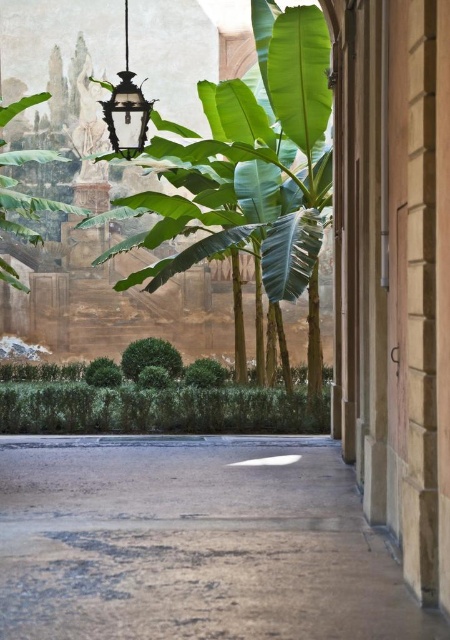
Between concrete sidewalk at center and green leafy shrubs at center, which one is positioned higher?

green leafy shrubs at center is higher up.

Is concrete sidewalk at center wider than green leafy shrubs at center?

In fact, concrete sidewalk at center might be narrower than green leafy shrubs at center.

At what (x,y) coordinates should I click in order to perform the action: click on concrete sidewalk at center. Please return your answer as a coordinate pair (x, y). The height and width of the screenshot is (640, 450). Looking at the image, I should click on (193, 545).

Between green leafy banana tree at upper left and green leafy shrubs at center, which one is positioned lower?

green leafy shrubs at center is below.

Does point (174, 272) come in front of point (88, 394)?

Yes, it is in front of point (88, 394).

Is point (261, 4) closer to camera compared to point (225, 429)?

No, it is not.

In order to click on green leafy banana tree at upper left in this screenshot , I will do click(x=241, y=166).

How distant is green leafy shrubs at center from black glass lantern at upper left?

green leafy shrubs at center is 12.03 feet away from black glass lantern at upper left.

Which is behind, point (287, 394) or point (130, 84)?

Point (287, 394)

You are a GUI agent. You are given a task and a screenshot of the screen. Output one action in this format:
    pyautogui.click(x=<x>, y=<y>)
    Task: Click on the green leafy shrubs at center
    
    Given the screenshot: What is the action you would take?
    click(x=153, y=397)